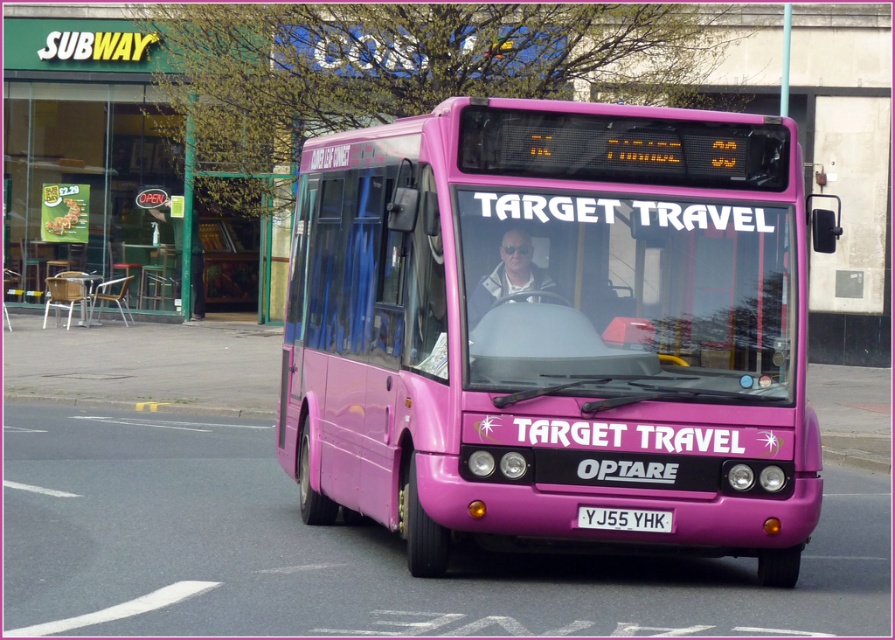
Question: Which object appears farthest from the camera in this image?

Choices:
 (A) matte black sunglasses at center
 (B) white plastic license plate at center
 (C) matte pink bus at center

Answer: (B)

Question: Which point is closer to the camera?

Choices:
 (A) white plastic license plate at center
 (B) matte pink bus at center
 (C) matte black sunglasses at center

Answer: (B)

Question: Does matte pink bus at center appear on the left side of white plastic license plate at center?

Choices:
 (A) no
 (B) yes

Answer: (B)

Question: Where is matte pink bus at center located in relation to white plastic license plate at center in the image?

Choices:
 (A) left
 (B) right

Answer: (A)

Question: Where is matte black sunglasses at center located in relation to white plastic license plate at center in the image?

Choices:
 (A) right
 (B) left

Answer: (B)

Question: Among these objects, which one is farthest from the camera?

Choices:
 (A) matte black sunglasses at center
 (B) matte pink bus at center
 (C) white plastic license plate at center

Answer: (C)